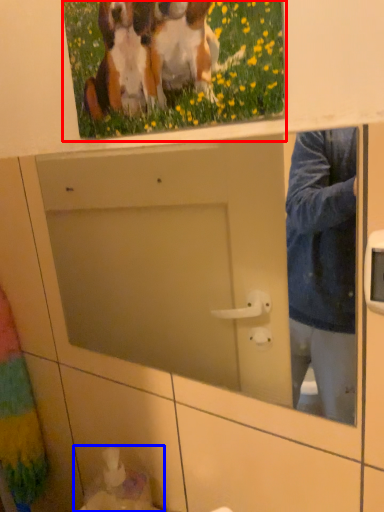
Question: Which point is closer to the camera, picture frame (highlighted by a red box) or sink (highlighted by a blue box)?

Choices:
 (A) picture frame
 (B) sink

Answer: (A)